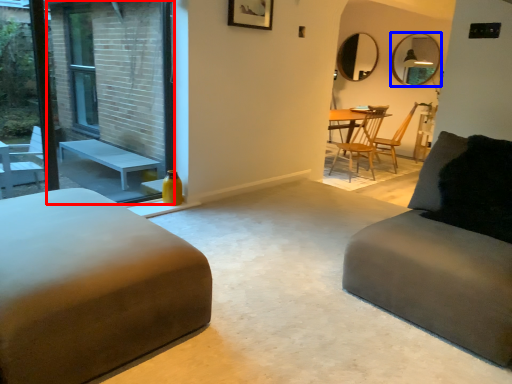
Question: Which of the following is the farthest to the observer, screen door (highlighted by a red box) or mirror (highlighted by a blue box)?

Choices:
 (A) screen door
 (B) mirror

Answer: (B)